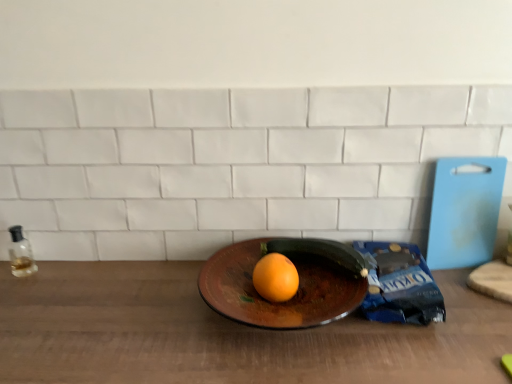
Question: Could you tell me if green matte zucchini at center is facing orange matte at center?

Choices:
 (A) no
 (B) yes

Answer: (B)

Question: Does green matte zucchini at center have a lesser width compared to orange matte at center?

Choices:
 (A) no
 (B) yes

Answer: (A)

Question: Is green matte zucchini at center not near orange matte at center?

Choices:
 (A) no
 (B) yes

Answer: (A)

Question: Can you confirm if green matte zucchini at center is smaller than orange matte at center?

Choices:
 (A) yes
 (B) no

Answer: (B)

Question: Considering the relative sizes of green matte zucchini at center and orange matte at center in the image provided, is green matte zucchini at center shorter than orange matte at center?

Choices:
 (A) no
 (B) yes

Answer: (B)

Question: Is green matte zucchini at center positioned before orange matte at center?

Choices:
 (A) no
 (B) yes

Answer: (A)

Question: Does transparent glass bottle at left turn towards green matte zucchini at center?

Choices:
 (A) no
 (B) yes

Answer: (A)

Question: Can you confirm if transparent glass bottle at left is smaller than green matte zucchini at center?

Choices:
 (A) no
 (B) yes

Answer: (B)

Question: Does transparent glass bottle at left have a lesser width compared to green matte zucchini at center?

Choices:
 (A) no
 (B) yes

Answer: (B)

Question: From a real-world perspective, is transparent glass bottle at left located beneath green matte zucchini at center?

Choices:
 (A) yes
 (B) no

Answer: (A)

Question: Is there a large distance between transparent glass bottle at left and green matte zucchini at center?

Choices:
 (A) no
 (B) yes

Answer: (A)

Question: Is transparent glass bottle at left with green matte zucchini at center?

Choices:
 (A) yes
 (B) no

Answer: (B)

Question: Does transparent glass bottle at left touch orange matte at center?

Choices:
 (A) no
 (B) yes

Answer: (A)